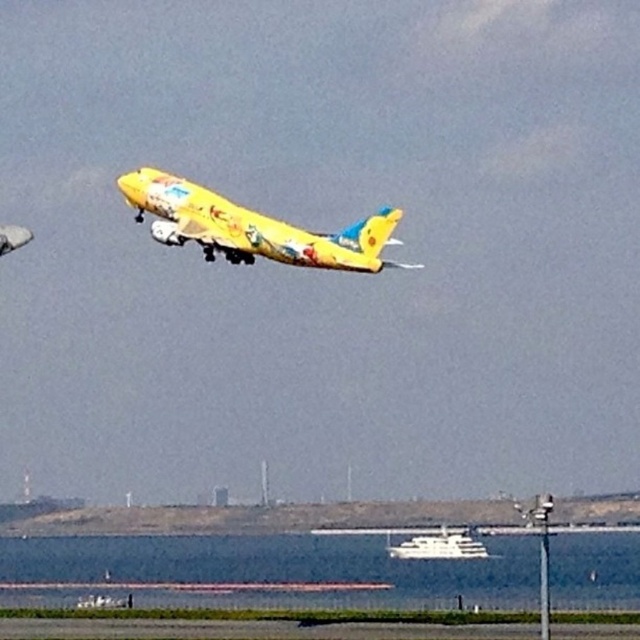
You are a pilot who needs to determine the altitude of your yellow matte airplane at center relative to the transparent water at lower center. According to the image, which object is lower in height?

The transparent water at lower center is shorter than the yellow matte airplane at center, so the transparent water at lower center is lower in height.

You are a photographer trying to capture the vibrant yellow airplane in mid flight. You notice two points marked on your camera screen at coordinates point (204, 246) and point (426, 536). Which point is closer to your camera lens?

Point (204, 246) is closer to the camera than point (426, 536).

You are a pilot flying the vibrant yellow airplane. You need to determine if the white glossy boat at lower center is visible above or below the transparent water at lower center. Based on the scene, what can you conclude?

The transparent water at lower center is taller than the white glossy boat at lower center, so the white glossy boat at lower center is below the transparent water at lower center.